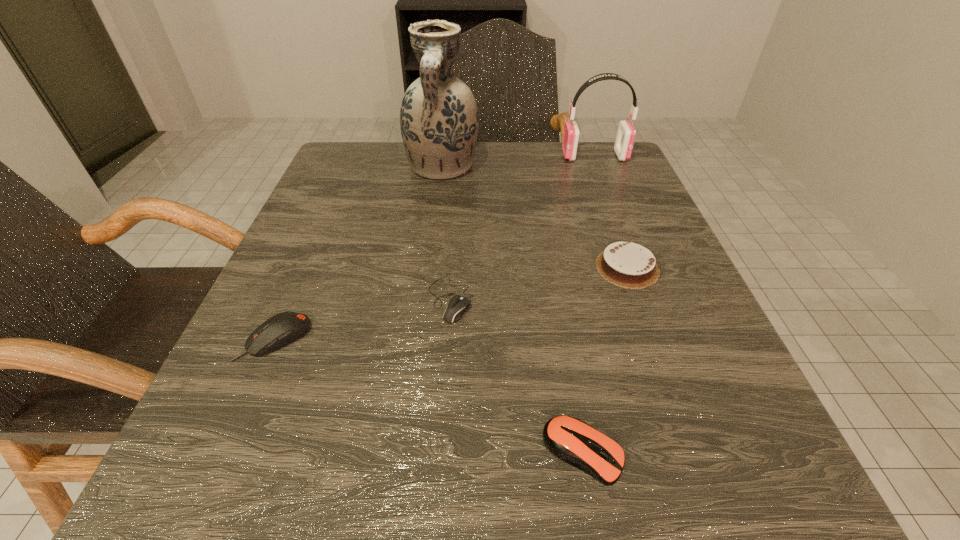
I want to click on the tallest object, so click(x=439, y=122).

Find the location of `the fifth shortest object`. the fifth shortest object is located at coordinates (626, 133).

Find the location of a particular element. the leftmost computer mouse is located at coordinates (283, 328).

I want to click on chocolate cake, so click(625, 264).

Locate an element on the screen. The height and width of the screenshot is (540, 960). the rightmost computer mouse is located at coordinates (570, 439).

Where is `the second tallest computer mouse`? The height and width of the screenshot is (540, 960). the second tallest computer mouse is located at coordinates (570, 439).

This screenshot has height=540, width=960. Identify the location of the shortest object. (457, 305).

Image resolution: width=960 pixels, height=540 pixels. In order to click on the second computer mouse from left to right in this screenshot , I will do `click(457, 305)`.

The height and width of the screenshot is (540, 960). In order to click on free location located 0.300m with the handle on the side of the vase in this screenshot , I will do `click(426, 292)`.

At what (x,y) coordinates should I click in order to perform the action: click on vacant area situated 0.060m on the outer surface of the earphone. Please return your answer as a coordinate pair (x, y). Looking at the image, I should click on 537,156.